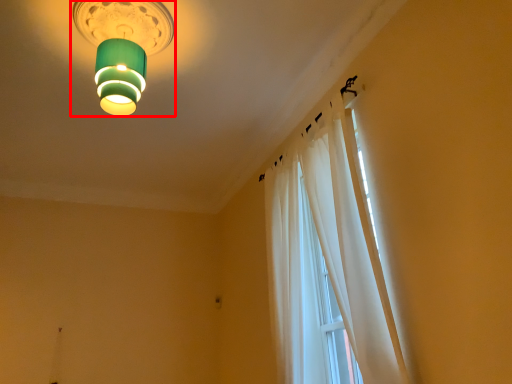
Question: Observing the image, what is the correct spatial positioning of lamp (annotated by the red box) in reference to curtain?

Choices:
 (A) right
 (B) left

Answer: (B)